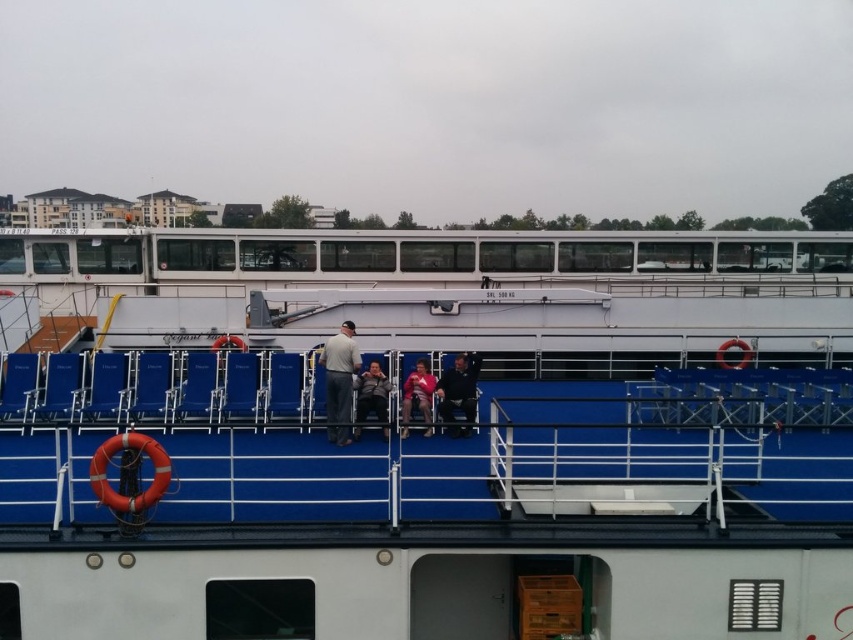
Which is more to the right, blue plastic chairs at center or dark gray fabric jacket at center?

Positioned to the right is blue plastic chairs at center.

From the picture: Between blue plastic chairs at center and dark gray fabric jacket at center, which one is positioned higher?

blue plastic chairs at center is above.

Locate an element on the screen. This screenshot has height=640, width=853. blue plastic chairs at center is located at coordinates (428, 436).

Is matte black jacket at center positioned at the back of matte pink shirt at center?

No, matte black jacket at center is in front of matte pink shirt at center.

Is point (364, 392) positioned before point (431, 396)?

Yes, point (364, 392) is in front of point (431, 396).

Looking at this image, measure the distance between point (360, 422) and camera.

Point (360, 422) is 10.80 meters away from camera.

Where is `matte black jacket at center`? matte black jacket at center is located at coordinates (370, 397).

How far apart are blue plastic chairs at center and matte black jacket at center?

blue plastic chairs at center is 7.52 meters from matte black jacket at center.

Is blue plastic chairs at center positioned at the back of matte black jacket at center?

That is False.

I want to click on blue plastic chairs at center, so click(428, 436).